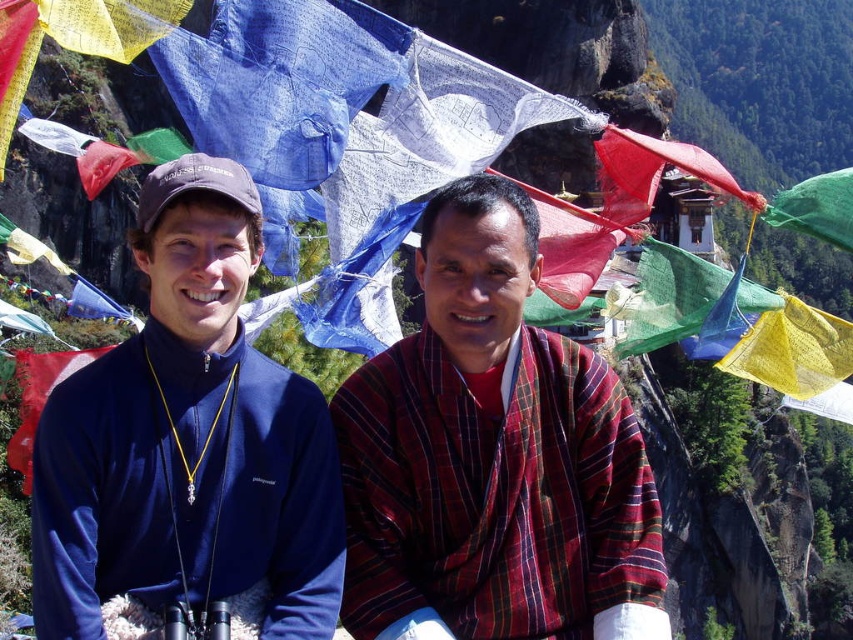
Between plaid fabric shirt at center and navy blue fleece at left, which one has more height?

plaid fabric shirt at center

Who is higher up, plaid fabric shirt at center or navy blue fleece at left?

navy blue fleece at left

The width and height of the screenshot is (853, 640). I want to click on plaid fabric shirt at center, so click(x=492, y=456).